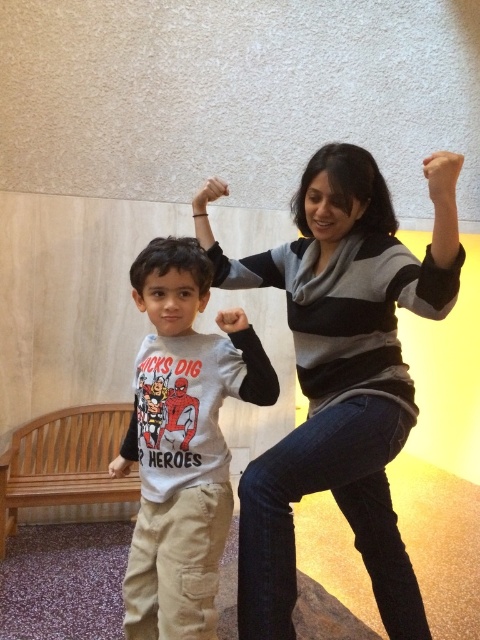
Question: Considering the real-world distances, which object is closest to the striped sweater at center?

Choices:
 (A) brown wooden bench at lower left
 (B) matte black sleeve at upper center
 (C) matte black arm at upper center

Answer: (B)

Question: Which point is farther to the camera?

Choices:
 (A) matte black arm at upper center
 (B) gray sweater at upper right
 (C) matte black hand at upper center
 (D) matte white hand at lower left

Answer: (D)

Question: Does brown wooden bench at lower left have a smaller size compared to matte black sleeve at upper center?

Choices:
 (A) no
 (B) yes

Answer: (A)

Question: Does striped sweater at center have a lesser width compared to matte black hand at upper center?

Choices:
 (A) yes
 (B) no

Answer: (B)

Question: Which of the following is the farthest from the observer?

Choices:
 (A) (236, 326)
 (B) (244, 483)
 (C) (120, 461)
 (D) (135, 365)

Answer: (D)

Question: Is white cotton shirt at center behind matte black arm at upper center?

Choices:
 (A) yes
 (B) no

Answer: (B)